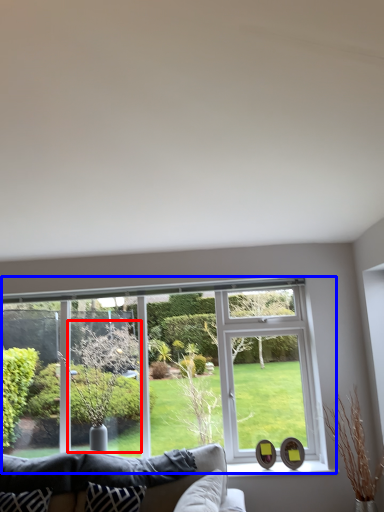
Question: Which point is closer to the camera, tree (highlighted by a red box) or window (highlighted by a blue box)?

Choices:
 (A) tree
 (B) window

Answer: (A)